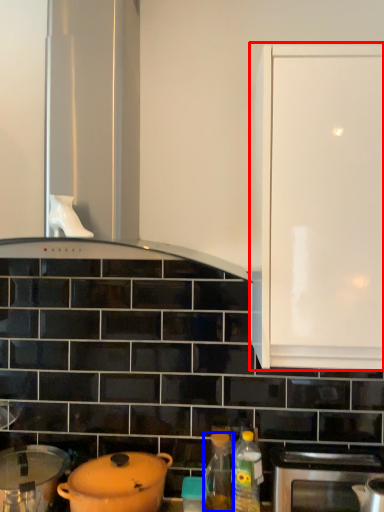
Question: Which of the following is the closest to the observer, cabinetry (highlighted by a red box) or bottle (highlighted by a blue box)?

Choices:
 (A) cabinetry
 (B) bottle

Answer: (A)